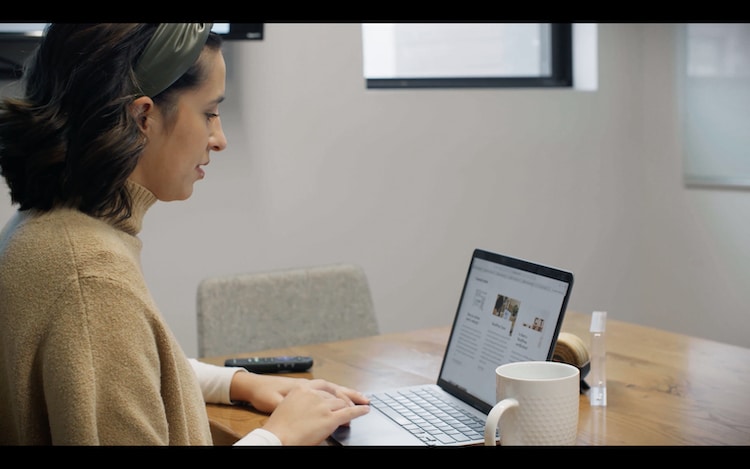
The height and width of the screenshot is (469, 750). In order to click on keyboard in this screenshot , I will do `click(428, 416)`.